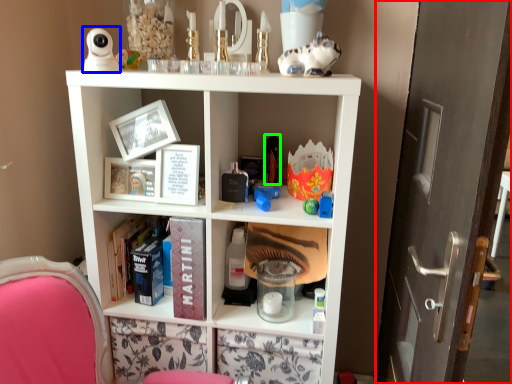
Question: Which is nearer to the glass door (highlighted by a red box)? toy (highlighted by a blue box) or toy (highlighted by a green box).

Choices:
 (A) toy
 (B) toy

Answer: (B)